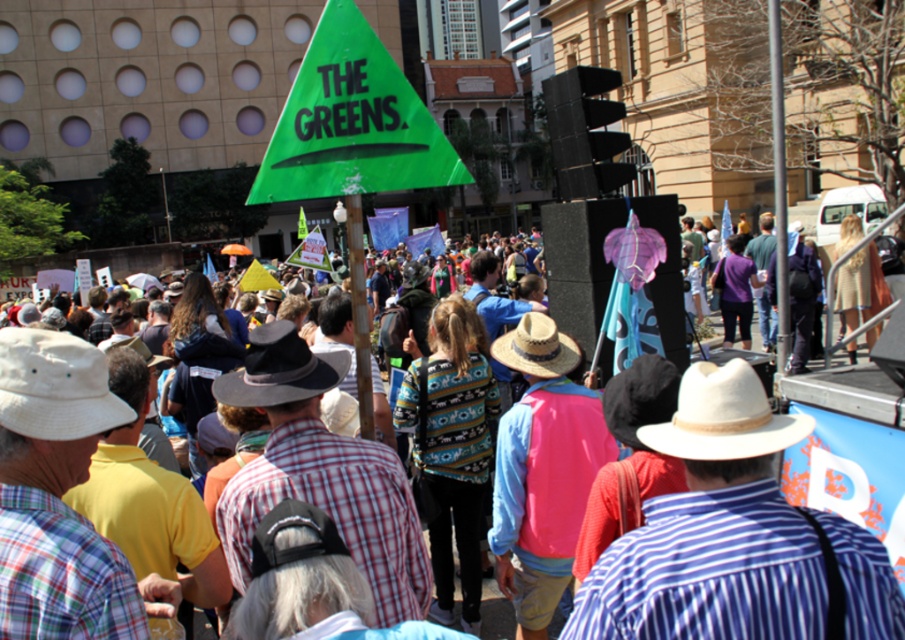
Does white straw cowboy hat at center have a greater width compared to dark brown felt cowboy hat at center?

In fact, white straw cowboy hat at center might be narrower than dark brown felt cowboy hat at center.

Does white straw cowboy hat at center appear under dark brown felt cowboy hat at center?

Correct, white straw cowboy hat at center is located below dark brown felt cowboy hat at center.

This screenshot has width=905, height=640. Describe the element at coordinates (724, 417) in the screenshot. I see `white straw cowboy hat at center` at that location.

Identify the location of white straw cowboy hat at center. (724, 417).

Does point (129, 412) come closer to viewer compared to point (234, 385)?

Yes.

Between white fabric cowboy hat at left and dark brown felt cowboy hat at center, which one appears on the left side from the viewer's perspective?

white fabric cowboy hat at left is more to the left.

Describe the element at coordinates (55, 387) in the screenshot. I see `white fabric cowboy hat at left` at that location.

Locate an element on the screen. The width and height of the screenshot is (905, 640). white fabric cowboy hat at left is located at coordinates click(x=55, y=387).

Does dark brown felt cowboy hat at center have a lesser height compared to strawhat at center?

In fact, dark brown felt cowboy hat at center may be taller than strawhat at center.

Is point (237, 378) more distant than point (570, 365)?

No.

Which is behind, point (248, 360) or point (530, 355)?

The point (530, 355) is more distant.

Locate an element on the screen. dark brown felt cowboy hat at center is located at coordinates (280, 371).